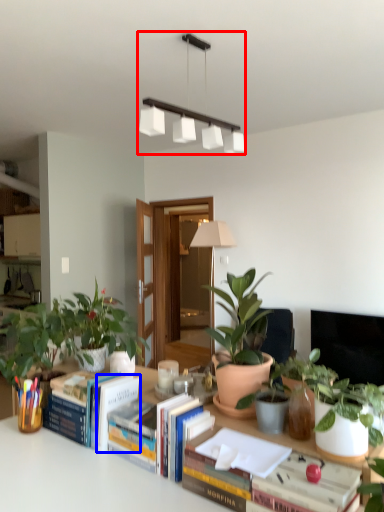
Question: Among these objects, which one is nearest to the camera, lamp (highlighted by a red box) or paperback book (highlighted by a blue box)?

Choices:
 (A) lamp
 (B) paperback book

Answer: (B)